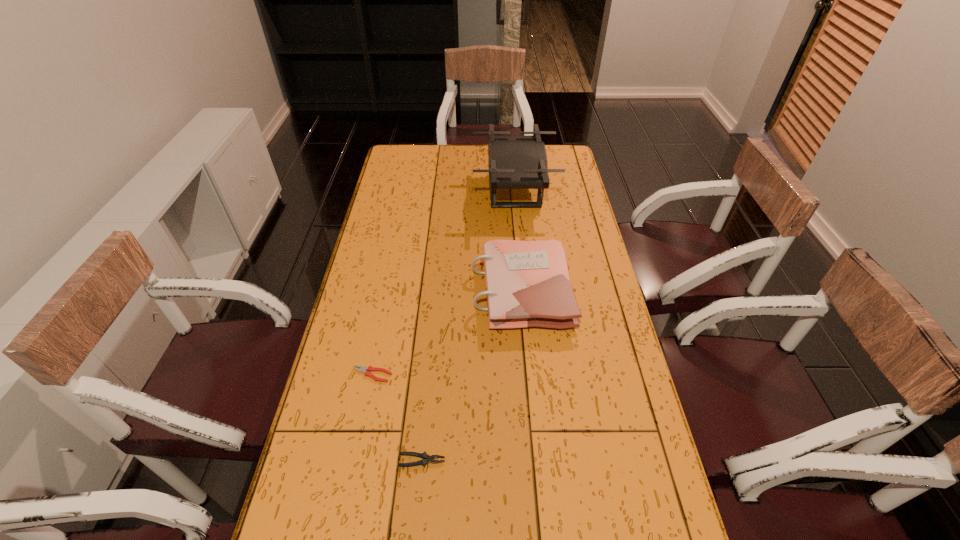
You are a GUI agent. You are given a task and a screenshot of the screen. Output one action in this format:
    pyautogui.click(x=<x>, y=<y>)
    Task: Click on the drone
    
    Given the screenshot: What is the action you would take?
    pyautogui.click(x=515, y=162)

The image size is (960, 540). I want to click on the tallest object, so click(515, 162).

You are a GUI agent. You are given a task and a screenshot of the screen. Output one action in this format:
    pyautogui.click(x=<x>, y=<y>)
    Task: Click on the third nearest object
    The width and height of the screenshot is (960, 540).
    Given the screenshot: What is the action you would take?
    pyautogui.click(x=527, y=282)

Identify the location of the second tallest object. (527, 282).

The image size is (960, 540). Find the location of `the right pliers`. the right pliers is located at coordinates (426, 458).

The width and height of the screenshot is (960, 540). I want to click on the nearest object, so click(426, 458).

Where is `the farther pliers`? This screenshot has width=960, height=540. the farther pliers is located at coordinates (366, 370).

Identify the location of the second nearest object. This screenshot has width=960, height=540. (366, 370).

Locate an element on the screen. This screenshot has height=540, width=960. free space located 0.180m with a camera mounted on the underside of the tallest object is located at coordinates (431, 191).

This screenshot has height=540, width=960. Find the location of `vacant space located with a camera mounted on the underside of the tallest object`. vacant space located with a camera mounted on the underside of the tallest object is located at coordinates (422, 191).